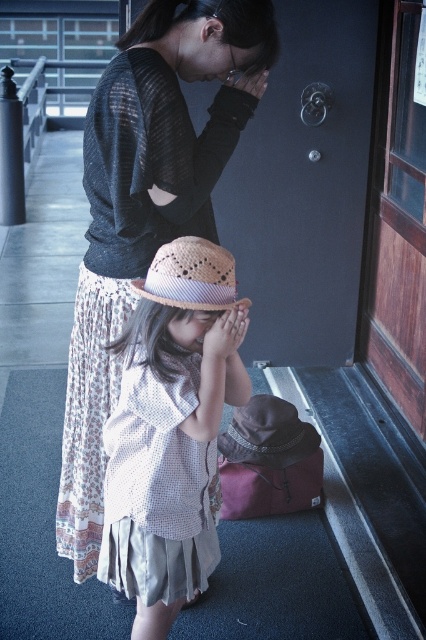
You are a visitor at this temple and want to place a 4 feet long decorative banner between the natural straw hat at center and the natural straw hat at lower center. Can you fit it between them?

The natural straw hat at center is 3.98 feet from the natural straw hat at lower center. Since the banner is 4 feet long, it is slightly longer than the distance between them, so it won

You are a photographer setting up for a portrait. You have a matte black sweater at upper center and a white textured shirt at center. The minimum distance your camera can focus on two subjects is 35 centimeters. Can both subjects be in focus at the same time?

The matte black sweater at upper center is 37.18 centimeters from the white textured shirt at center. Since the distance between them is greater than the camera minimum focusing distance of 35 centimeters, both subjects can be in focus simultaneously.